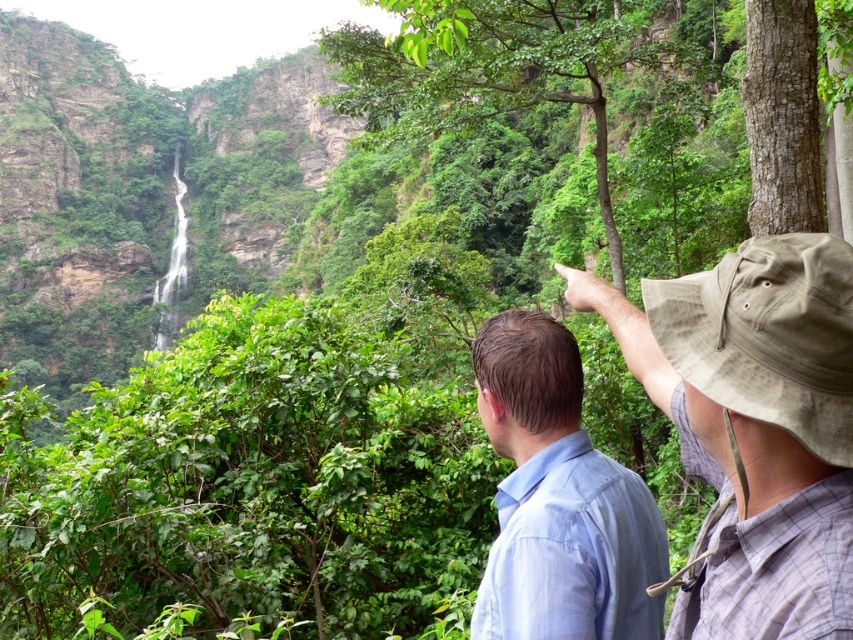
You are hiking in a forest and see the light blue shirt at center and the green leafy tree at upper center. Which object is higher up in the scene?

The green leafy tree at upper center is higher up in the scene than the light blue shirt at center.

You are hiking in the area and want to take a photo of the green leafy tree at upper center and the brown rough bark tree at upper right. Which tree should you stand to the right of to capture both in your shot?

You should stand to the right of the brown rough bark tree at upper right to include both the green leafy tree at upper center and the brown rough bark tree at upper right in your photo since the green leafy tree at upper center is positioned to the left of the brown rough bark tree at upper right.